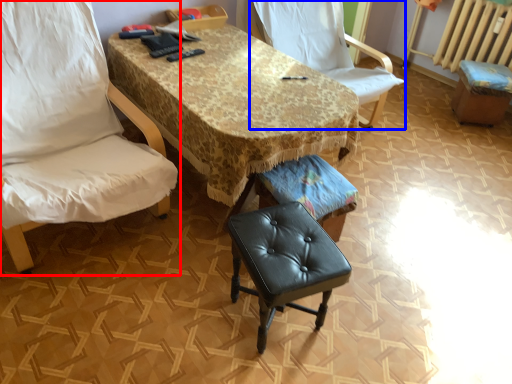
Question: Which point is further to the camera, chair (highlighted by a red box) or chair (highlighted by a blue box)?

Choices:
 (A) chair
 (B) chair

Answer: (B)